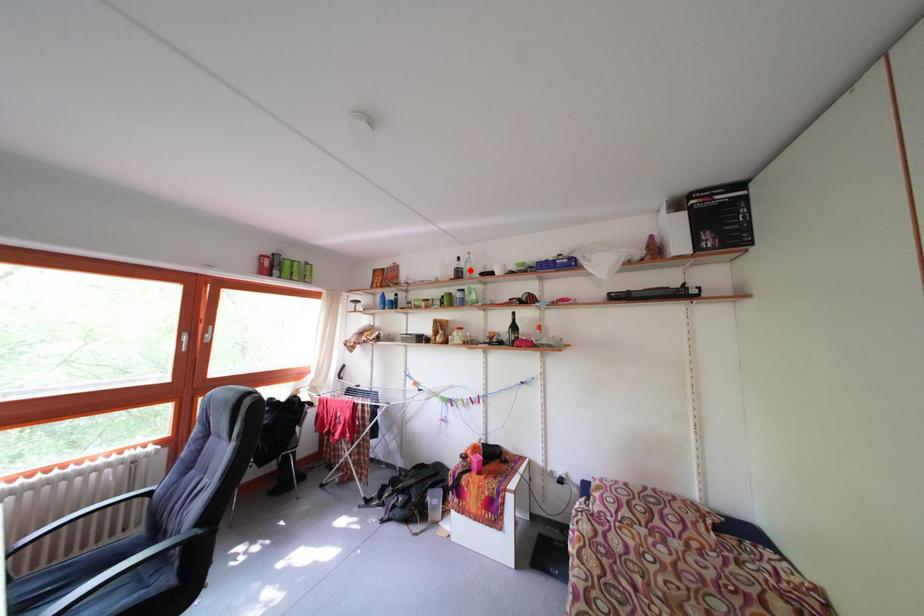
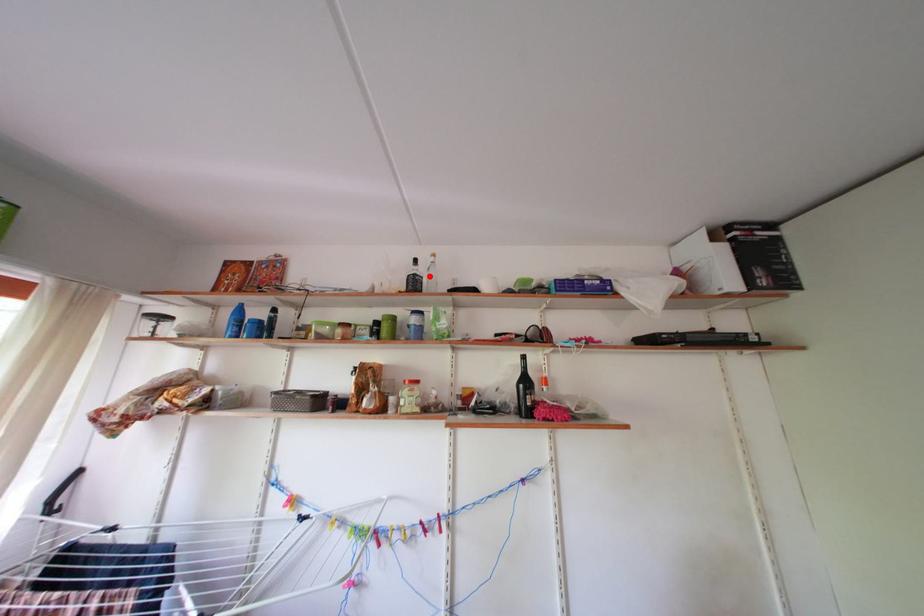
I am providing you with two images of the same scene from different viewpoints. A red point is marked on the first image and another point is marked on the second image. Do the highlighted points in image1 and image2 indicate the same real-world spot?

Yes